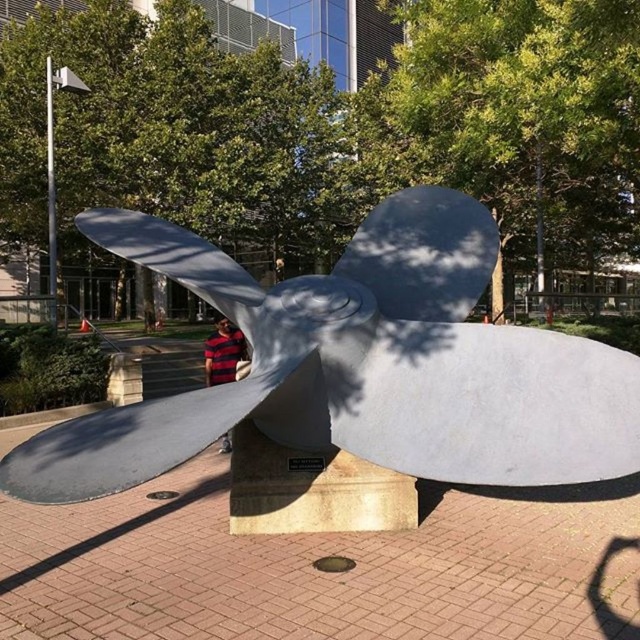
Question: Which point is closer to the camera?

Choices:
 (A) satin silver propeller at center
 (B) striped fabric at center

Answer: (A)

Question: Where is satin silver propeller at center located in relation to striped fabric at center in the image?

Choices:
 (A) right
 (B) left

Answer: (A)

Question: Is satin silver propeller at center positioned in front of striped fabric at center?

Choices:
 (A) yes
 (B) no

Answer: (A)

Question: Which object is farther from the camera taking this photo?

Choices:
 (A) satin silver propeller at center
 (B) striped fabric at center

Answer: (B)

Question: Is satin silver propeller at center bigger than striped fabric at center?

Choices:
 (A) yes
 (B) no

Answer: (B)